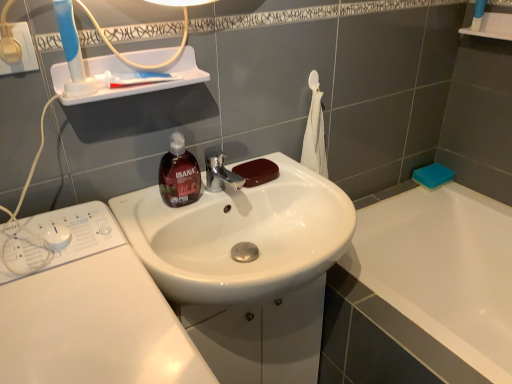
Locate an element on the screen. The height and width of the screenshot is (384, 512). vacant area that is in front of translucent brown soap dispenser at center is located at coordinates (160, 224).